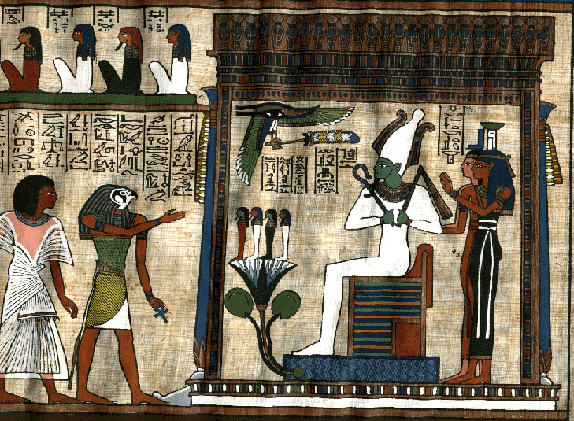
Where is `fan`? fan is located at coordinates (329, 135).